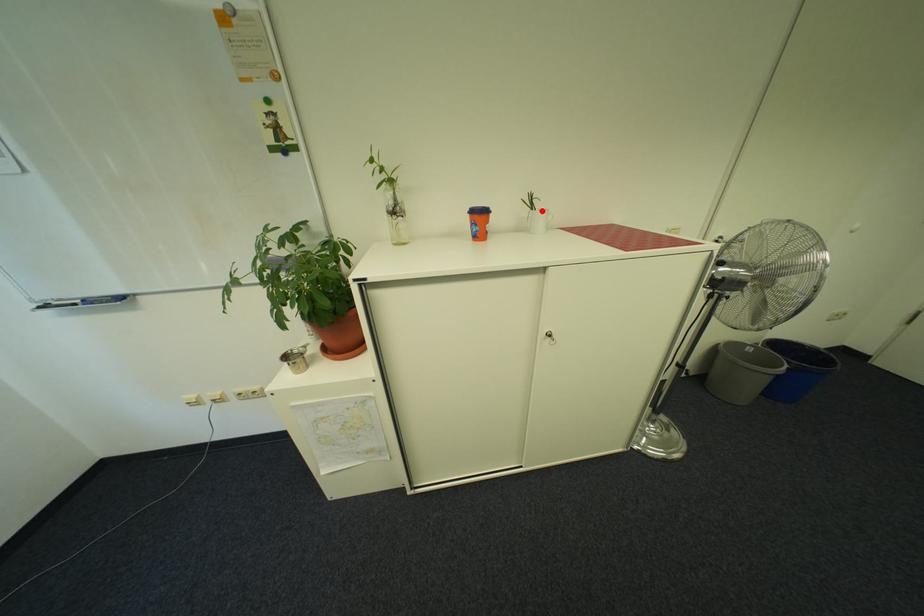
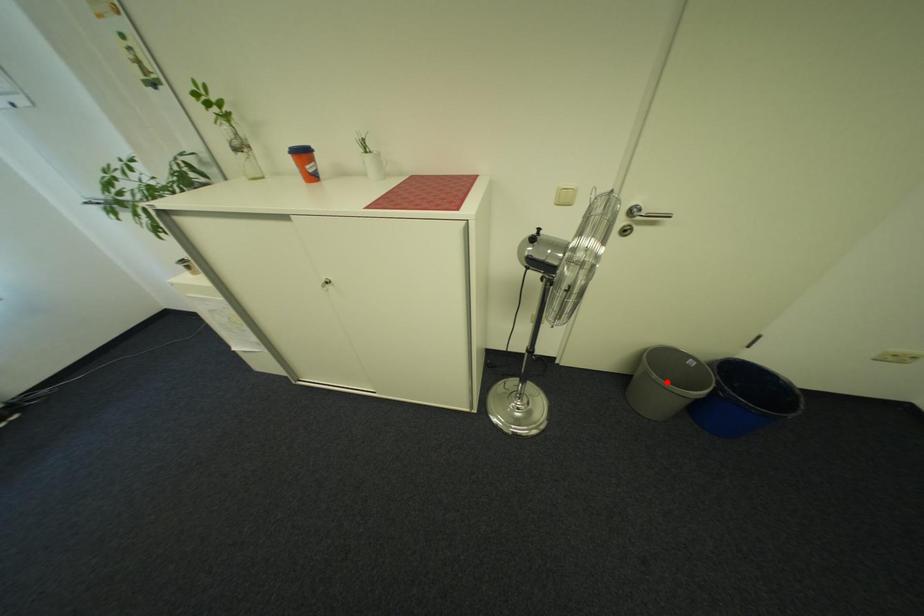
I am providing you with two images of the same scene from different viewpoints. A red point is marked on the first image and another point is marked on the second image. Do the highlighted points in image1 and image2 indicate the same real-world spot?

No